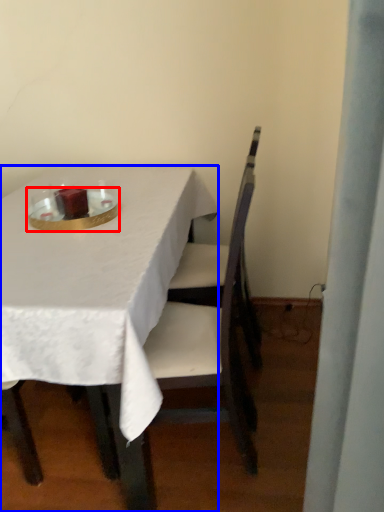
Question: Which object appears closest to the camera in this image, tableware (highlighted by a red box) or table (highlighted by a blue box)?

Choices:
 (A) tableware
 (B) table

Answer: (B)